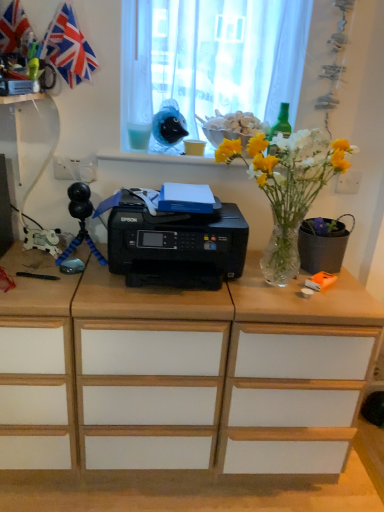
The height and width of the screenshot is (512, 384). What are the coordinates of `free point in front of black matte flowerpot at right` in the screenshot? It's located at (316, 288).